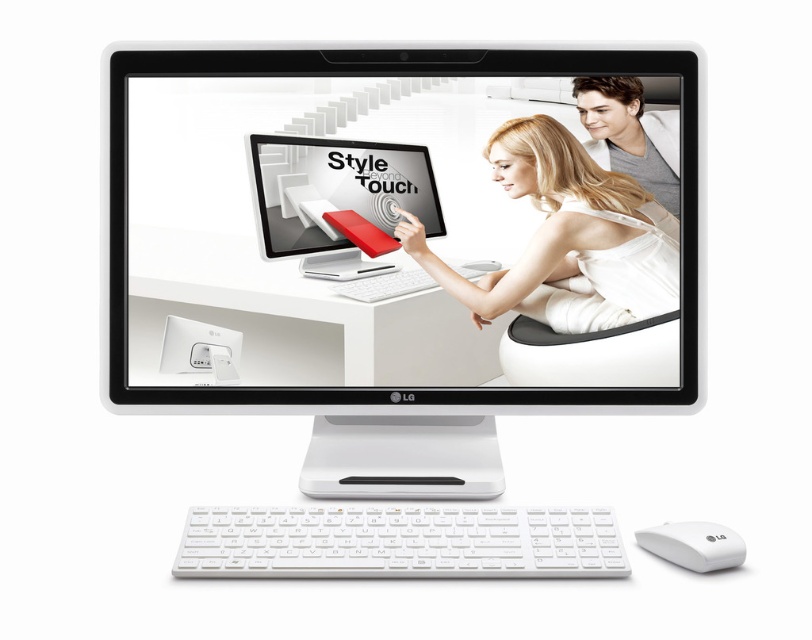
You are setting up a new computer desk and want to ensure there is enough vertical space between the matte plastic monitor at center and the smooth white shirt at upper right. Based on the image, which object takes up more vertical space?

The smooth white shirt at upper right takes up more vertical space than the matte plastic monitor at center because the matte plastic monitor at center is not as tall as smooth white shirt at upper right.

You are setting up a new computer desk and want to ensure there is enough vertical space between the white glossy monitor at center and the white plastic keyboard at lower center. Based on the image, which object takes up more vertical space?

The white glossy monitor at center is much taller than the white plastic keyboard at lower center, so it takes up more vertical space.

Consider the image. You are setting up a new workspace and want to ensure that the matte plastic monitor at center and the smooth white shirt at upper right are visible from across the room. Considering their sizes, which object will likely be more noticeable?

The matte plastic monitor at center is larger in size than the smooth white shirt at upper right, so it will likely be more noticeable from across the room due to its larger size.